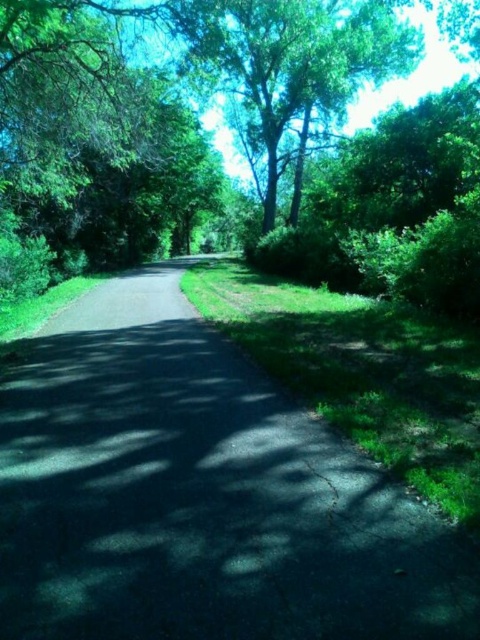
You are a gardener planning to place a 3m wide decorative archway along the dark asphalt path at center. Considering the path is wider than the green leafy tree at upper center, can you determine if the archway will fit on the path without encroaching into the tree area?

The dark asphalt path at center is wider than the green leafy tree at upper center, so the 3m wide decorative archway can be placed on the path without encroaching into the tree area as the path has sufficient width.